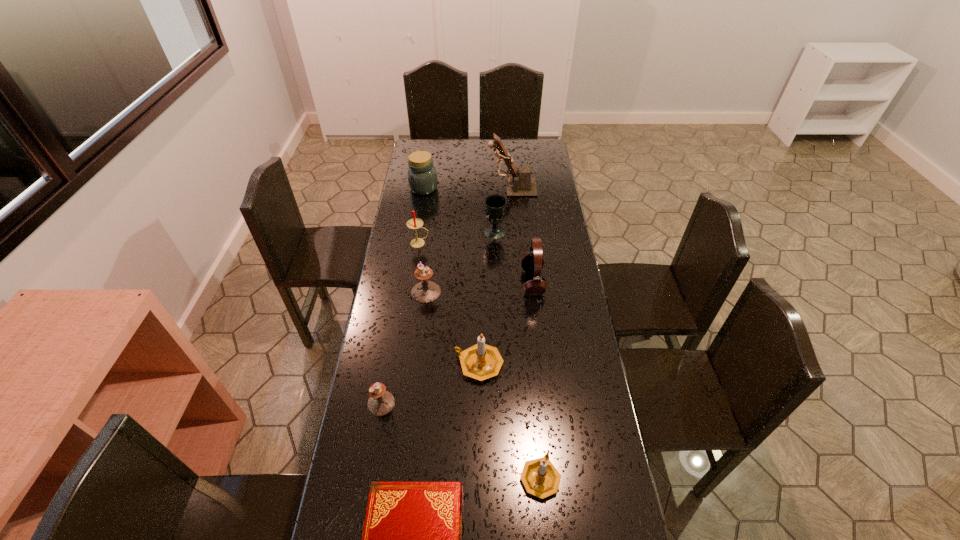
You are a GUI agent. You are given a task and a screenshot of the screen. Output one action in this format:
    pyautogui.click(x=<x>, y=<y>)
    Task: Click on the vacant space located on the back of the candle
    
    Given the screenshot: What is the action you would take?
    [x=426, y=194]

In order to click on free region located on the front of the green jar in this screenshot , I will do `click(416, 243)`.

Where is `vacant region located on the front of the chalice`? The image size is (960, 540). vacant region located on the front of the chalice is located at coordinates [x=495, y=256].

Where is `vacant space located 0.080m on the right of the farthest candle holder`? Image resolution: width=960 pixels, height=540 pixels. vacant space located 0.080m on the right of the farthest candle holder is located at coordinates tap(463, 292).

You are a GUI agent. You are given a task and a screenshot of the screen. Output one action in this format:
    pyautogui.click(x=<x>, y=<y>)
    Task: Click on the vacant region located on the front of the third nearest candle holder
    The width and height of the screenshot is (960, 540).
    Given the screenshot: What is the action you would take?
    pyautogui.click(x=478, y=450)

Image resolution: width=960 pixels, height=540 pixels. I want to click on free spot located on the back of the third nearest object, so tap(387, 372).

Image resolution: width=960 pixels, height=540 pixels. Identify the location of blank space located 0.060m on the left of the right gold candle holder. (497, 477).

This screenshot has height=540, width=960. Identify the location of candle located at the left edge. (415, 223).

I want to click on jar positioned at the left edge, so click(x=422, y=177).

The width and height of the screenshot is (960, 540). Identify the location of figurine positioned at the right edge. (521, 184).